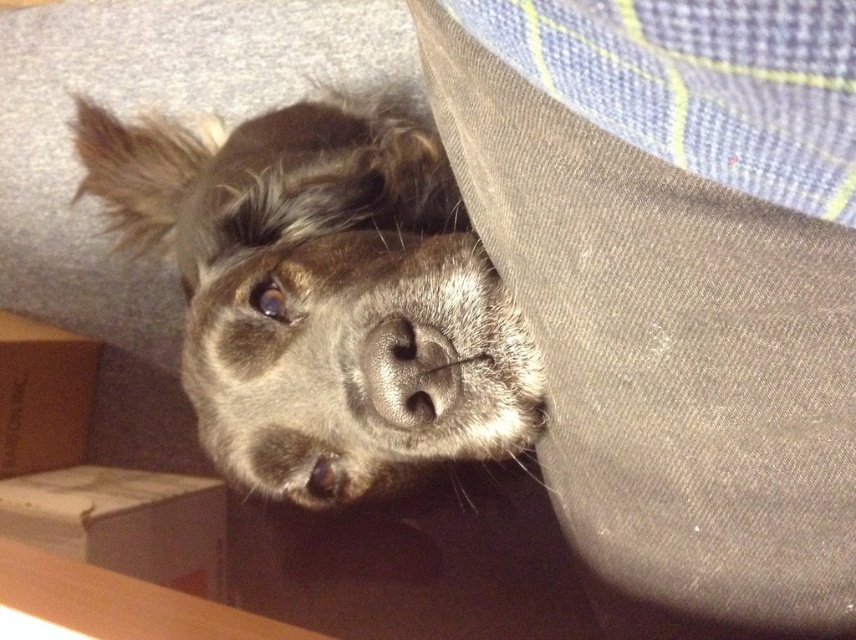
From the picture: What is located at the coordinates point (322, 296) in the image?

The point (322, 296) marks the fuzzy brown dog at center.

In the scene shown: You are holding a 60 cm long stick. You want to reach the point marked at coordinates point (482, 266) with the tip of the stick. Can you reach it?

The distance of point (482, 266) from camera is 62.62 centimeters. Since the stick is only 60 cm long, you cannot reach the point marked at coordinates point (482, 266) with the tip of the stick.

You are a photographer trying to capture the dog in the image. The dog is hiding under furniture. You want to adjust your camera to focus on the fuzzy brown dog at center and the sleek gray nose at center. Based on their positions, which object should you focus on first if you want to start from the left side?

The fuzzy brown dog at center is to the left of the sleek gray nose at center, so you should focus on the fuzzy brown dog at center first since it is positioned further to the left.